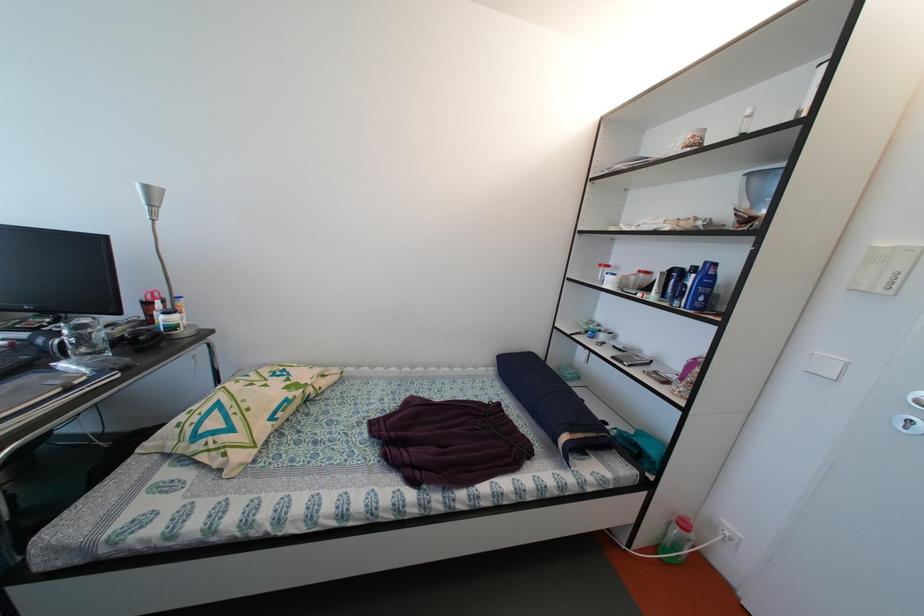
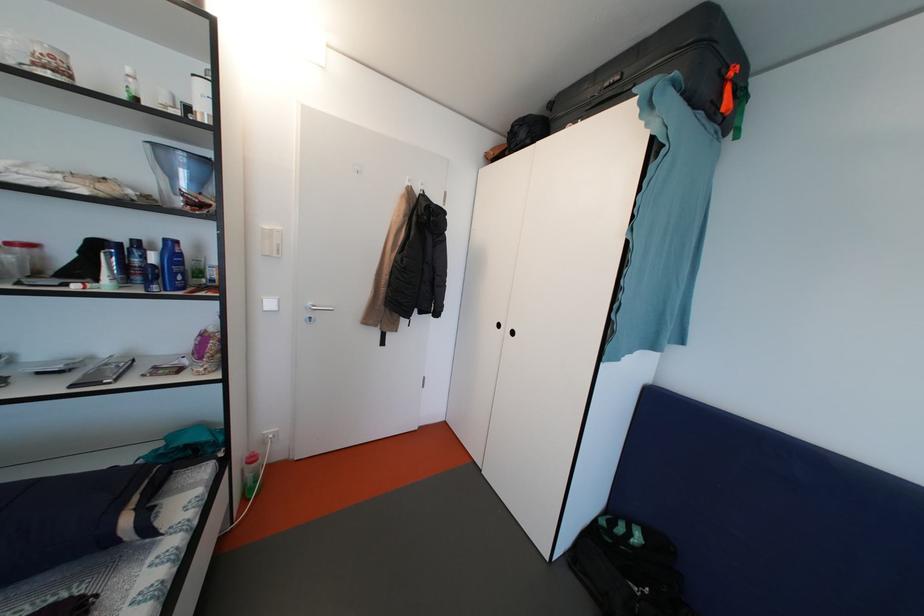
Based on the continuous images, in which direction is the camera rotating?

The camera rotated toward right-down.